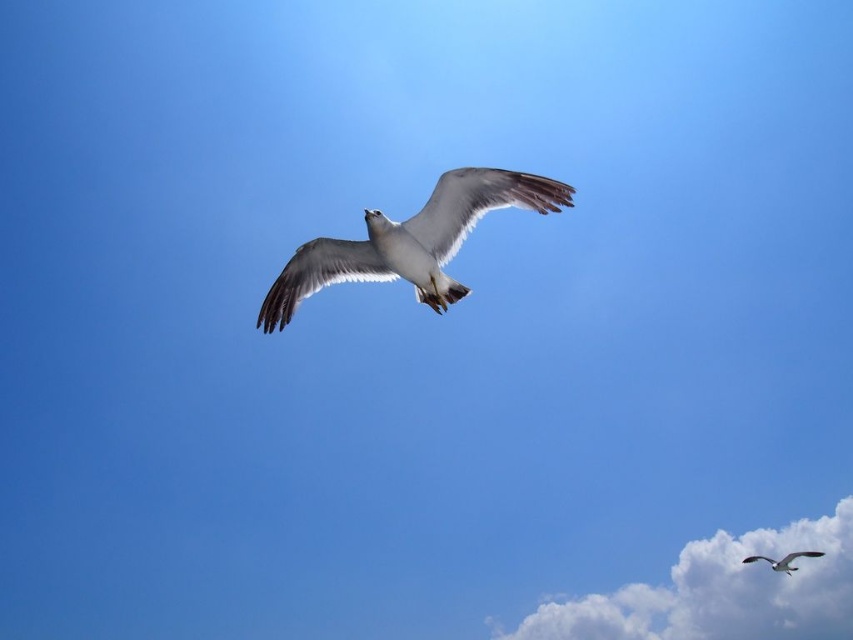
You are a birdwatcher observing the scene and want to take a photo of the white feathered bird at lower right without the white fluffy cloud at lower right blocking it. Can you adjust your camera angle to achieve this?

The white fluffy cloud at lower right is closer to you than the white feathered bird at lower right. By adjusting the camera angle slightly upwards or to the side, you can position the cloud out of the frame while keeping the bird in view, as the bird is farther away and the cloud is closer.

You are a pilot flying a small airplane and need to avoid obstacles. You see a white fluffy cloud at lower right and a white feathered bird at center. Which one is wider?

The white fluffy cloud at lower right might be wider than white feathered bird at center according to the description.